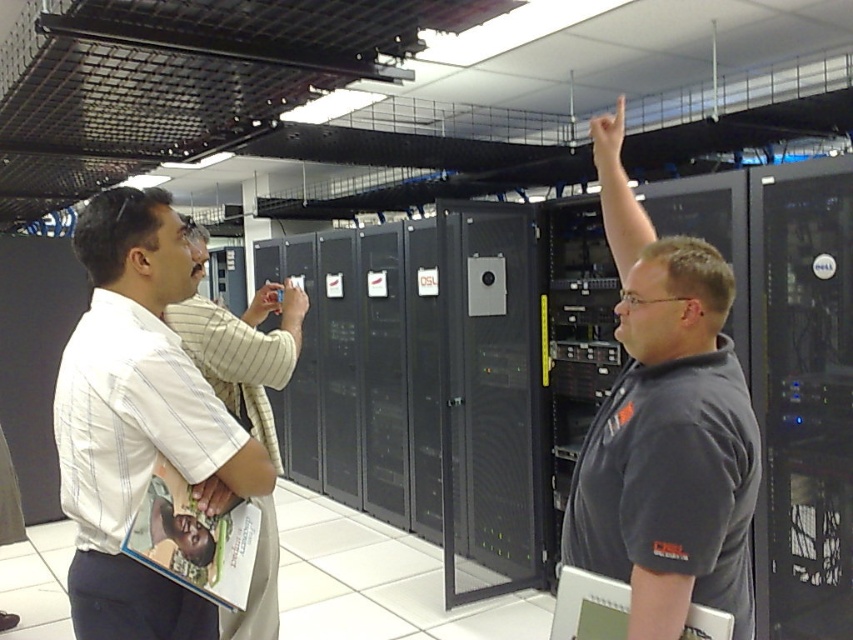
Question: Is white striped shirt at center to the left of matte gray laptop at center from the viewer's perspective?

Choices:
 (A) no
 (B) yes

Answer: (B)

Question: Which of the following is the closest to the observer?

Choices:
 (A) matte gray laptop at center
 (B) white striped shirt at center
 (C) dark gray shirt at center
 (D) white striped shirt at left

Answer: (A)

Question: Which object is the closest to the dark gray shirt at center?

Choices:
 (A) white striped shirt at left
 (B) white striped shirt at center
 (C) matte gray laptop at center

Answer: (C)

Question: Is white striped shirt at left positioned before white striped shirt at center?

Choices:
 (A) no
 (B) yes

Answer: (B)

Question: Among these points, which one is nearest to the camera?

Choices:
 (A) (102, 330)
 (B) (718, 486)
 (C) (257, 609)

Answer: (B)

Question: Is dark gray shirt at center bigger than white striped shirt at left?

Choices:
 (A) no
 (B) yes

Answer: (A)